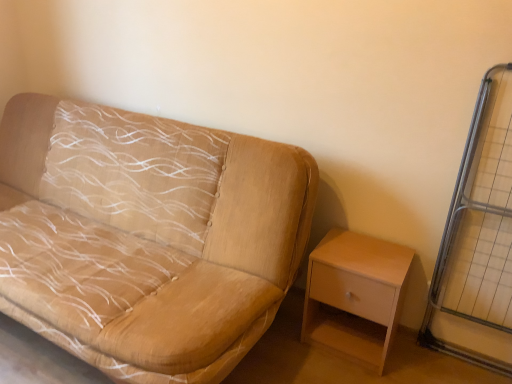
Question: Can you confirm if metal grid at right is smaller than light wood/wooden nightstand at lower right?

Choices:
 (A) yes
 (B) no

Answer: (A)

Question: Is metal grid at right wider than light wood/wooden nightstand at lower right?

Choices:
 (A) yes
 (B) no

Answer: (B)

Question: Is metal grid at right shorter than light wood/wooden nightstand at lower right?

Choices:
 (A) no
 (B) yes

Answer: (A)

Question: Does metal grid at right have a greater height compared to light wood/wooden nightstand at lower right?

Choices:
 (A) yes
 (B) no

Answer: (A)

Question: Would you say metal grid at right contains light wood/wooden nightstand at lower right?

Choices:
 (A) no
 (B) yes

Answer: (A)

Question: From a real-world perspective, relative to beige fabric couch at left, is metal grid at right vertically above or below?

Choices:
 (A) below
 (B) above

Answer: (B)

Question: Considering the positions of point (472, 288) and point (60, 241), is point (472, 288) closer or farther from the camera than point (60, 241)?

Choices:
 (A) closer
 (B) farther

Answer: (A)

Question: Looking at their shapes, would you say metal grid at right is wider or thinner than beige fabric couch at left?

Choices:
 (A) wide
 (B) thin

Answer: (B)

Question: Based on their sizes in the image, would you say metal grid at right is bigger or smaller than beige fabric couch at left?

Choices:
 (A) small
 (B) big

Answer: (A)

Question: In the image, is beige fabric couch at left positioned in front of or behind metal grid at right?

Choices:
 (A) front
 (B) behind

Answer: (A)

Question: From a real-world perspective, is beige fabric couch at left physically located above or below metal grid at right?

Choices:
 (A) above
 (B) below

Answer: (B)

Question: From the image's perspective, is beige fabric couch at left located above or below metal grid at right?

Choices:
 (A) below
 (B) above

Answer: (B)

Question: Does point (108, 322) appear closer or farther from the camera than point (505, 72)?

Choices:
 (A) closer
 (B) farther

Answer: (A)

Question: From their relative heights in the image, would you say metal grid at right is taller or shorter than light wood/wooden nightstand at lower right?

Choices:
 (A) short
 (B) tall

Answer: (B)

Question: From the image's perspective, is metal grid at right located above or below light wood/wooden nightstand at lower right?

Choices:
 (A) above
 (B) below

Answer: (A)